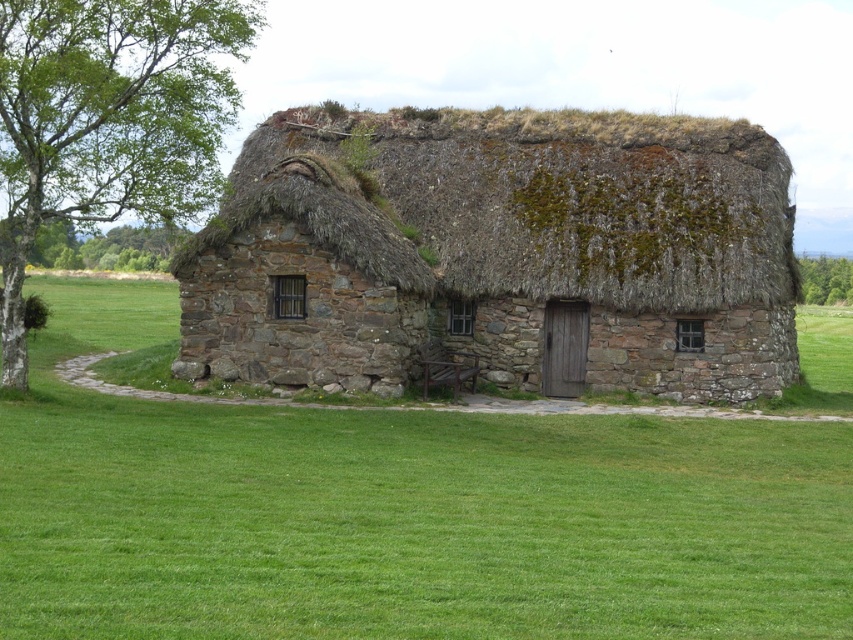
Question: Does rustic stone hut at center have a larger size compared to green leafy tree at upper left?

Choices:
 (A) no
 (B) yes

Answer: (A)

Question: Does rustic stone hut at center appear over green leafy tree at left?

Choices:
 (A) no
 (B) yes

Answer: (A)

Question: Among these points, which one is nearest to the camera?

Choices:
 (A) (608, 273)
 (B) (192, 144)

Answer: (B)

Question: Which object appears closest to the camera in this image?

Choices:
 (A) green leafy tree at upper right
 (B) rustic stone hut at center
 (C) green leafy tree at left
 (D) green leafy tree at upper left

Answer: (C)

Question: Which object appears closest to the camera in this image?

Choices:
 (A) green leafy tree at left
 (B) green leafy tree at upper right
 (C) rustic stone hut at center
 (D) green leafy tree at upper left

Answer: (A)

Question: Can you confirm if rustic stone hut at center is thinner than green leafy tree at upper right?

Choices:
 (A) no
 (B) yes

Answer: (B)